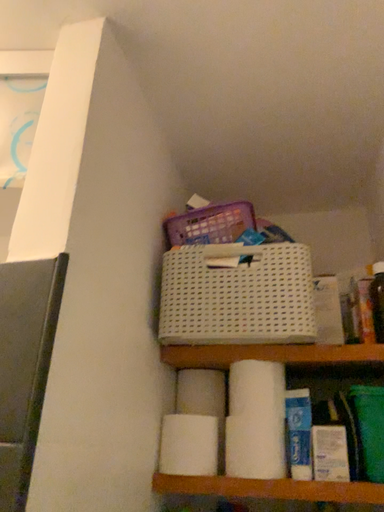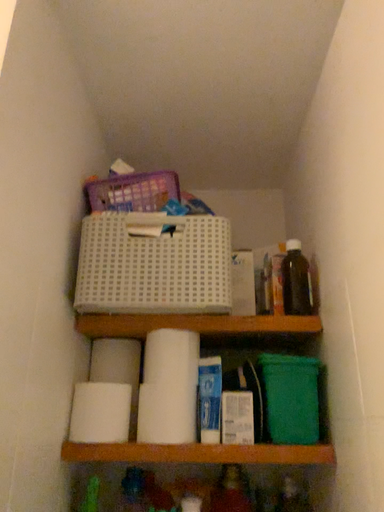
Question: Which way did the camera rotate in the video?

Choices:
 (A) rotated left
 (B) rotated right

Answer: (B)